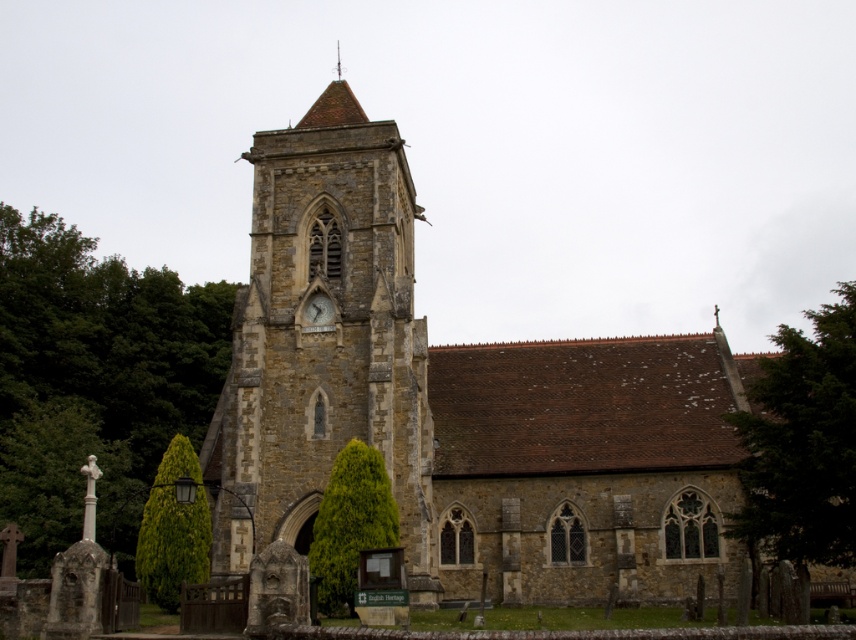
Question: Does green leafy tree at right appear over matte stone clock at center?

Choices:
 (A) yes
 (B) no

Answer: (B)

Question: Which of the following is the farthest from the observer?

Choices:
 (A) brown stone clock tower at center
 (B) green leafy tree at left

Answer: (B)

Question: Can you confirm if matte stone clock at center is positioned to the right of shiny silver spire at upper center?

Choices:
 (A) no
 (B) yes

Answer: (B)

Question: Considering the real-world distances, which object is farthest from the shiny silver spire at upper center?

Choices:
 (A) green leafy tree at right
 (B) brown stone church at center

Answer: (A)

Question: Does brown stone clock tower at center have a larger size compared to green leafy tree at lower left?

Choices:
 (A) no
 (B) yes

Answer: (B)

Question: Which object is farther from the camera taking this photo?

Choices:
 (A) brown stone church at center
 (B) green leafy tree at center

Answer: (A)